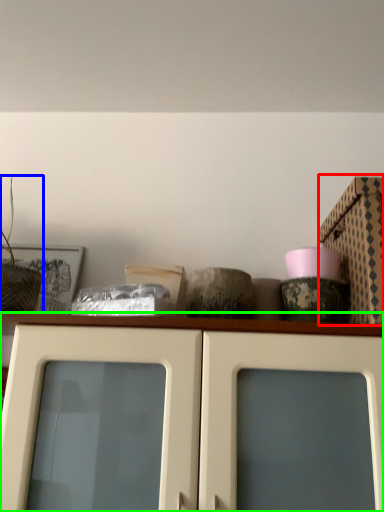
Question: Which object is positioned closest to cardboard box (highlighted by a red box)? Select from plant (highlighted by a blue box) and cabinetry (highlighted by a green box).

Choices:
 (A) plant
 (B) cabinetry

Answer: (B)